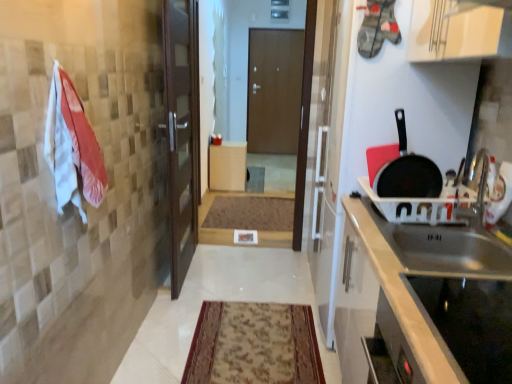
Question: Is stainless steel sink at right located outside black glass cooktop at lower right?

Choices:
 (A) no
 (B) yes

Answer: (B)

Question: From the image's perspective, is stainless steel sink at right located beneath black glass cooktop at lower right?

Choices:
 (A) yes
 (B) no

Answer: (B)

Question: From the image's perspective, is stainless steel sink at right above black glass cooktop at lower right?

Choices:
 (A) no
 (B) yes

Answer: (B)

Question: Is stainless steel sink at right thinner than black glass cooktop at lower right?

Choices:
 (A) no
 (B) yes

Answer: (A)

Question: Is stainless steel sink at right to the left of black glass cooktop at lower right from the viewer's perspective?

Choices:
 (A) yes
 (B) no

Answer: (B)

Question: Would you say carpeted rug at center, placed as the second mat when sorted from back to front, is inside or outside stainless steel sink at right?

Choices:
 (A) inside
 (B) outside

Answer: (B)

Question: In terms of width, does carpeted rug at center, placed as the second mat when sorted from back to front, look wider or thinner when compared to stainless steel sink at right?

Choices:
 (A) wide
 (B) thin

Answer: (A)

Question: Considering the positions of point (188, 362) and point (403, 347), is point (188, 362) closer or farther from the camera than point (403, 347)?

Choices:
 (A) closer
 (B) farther

Answer: (B)

Question: Relative to stainless steel sink at right, is carpeted rug at center, placed as the second mat when sorted from back to front, in front or behind?

Choices:
 (A) front
 (B) behind

Answer: (B)

Question: From a real-world perspective, is black glass cooktop at lower right above or below white cotton towel at left?

Choices:
 (A) above
 (B) below

Answer: (B)

Question: Choose the correct answer: Is black glass cooktop at lower right inside white cotton towel at left or outside it?

Choices:
 (A) outside
 (B) inside

Answer: (A)

Question: Would you say black glass cooktop at lower right is to the left or to the right of white cotton towel at left in the picture?

Choices:
 (A) right
 (B) left

Answer: (A)

Question: From the image's perspective, is black glass cooktop at lower right positioned above or below white cotton towel at left?

Choices:
 (A) below
 (B) above

Answer: (A)

Question: From the image's perspective, is white cotton towel at left above or below black matte frying pan at right?

Choices:
 (A) below
 (B) above

Answer: (B)

Question: In terms of size, does white cotton towel at left appear bigger or smaller than black matte frying pan at right?

Choices:
 (A) big
 (B) small

Answer: (A)